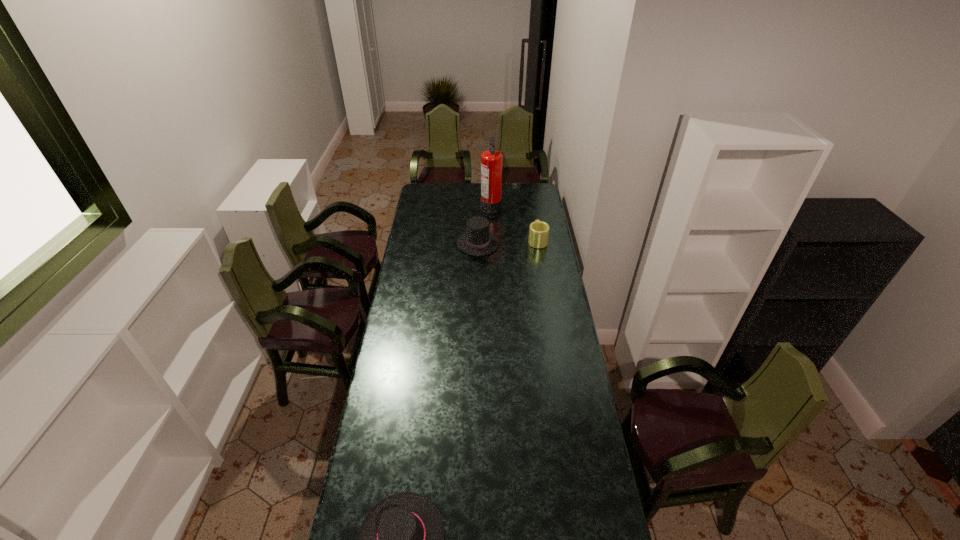
Where is `vacant area situated with the handle on the side of the mug`? The width and height of the screenshot is (960, 540). vacant area situated with the handle on the side of the mug is located at coordinates [x=535, y=221].

In order to click on free space located with the handle on the side of the mug in this screenshot , I will do `click(534, 217)`.

Where is `free space located with the handle on the side of the mug`? The height and width of the screenshot is (540, 960). free space located with the handle on the side of the mug is located at coordinates (535, 222).

I want to click on object that is at the far edge, so click(x=491, y=160).

Locate an element on the screen. object at the right edge is located at coordinates (538, 231).

In the image, there is a desktop. Identify the location of vacant space at the far edge. (457, 188).

Identify the location of free space at the left edge of the desktop. (406, 278).

I want to click on vacant area at the right edge, so click(551, 287).

Locate an element on the screen. vacant point located between the second shortest object and the tallest object is located at coordinates (515, 223).

The width and height of the screenshot is (960, 540). In order to click on empty space that is in between the tallest object and the mug in this screenshot , I will do `click(515, 223)`.